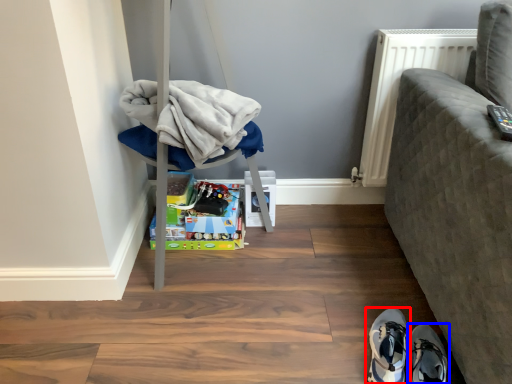
Question: Which object appears closest to the camera in this image, footwear (highlighted by a red box) or footwear (highlighted by a blue box)?

Choices:
 (A) footwear
 (B) footwear

Answer: (B)